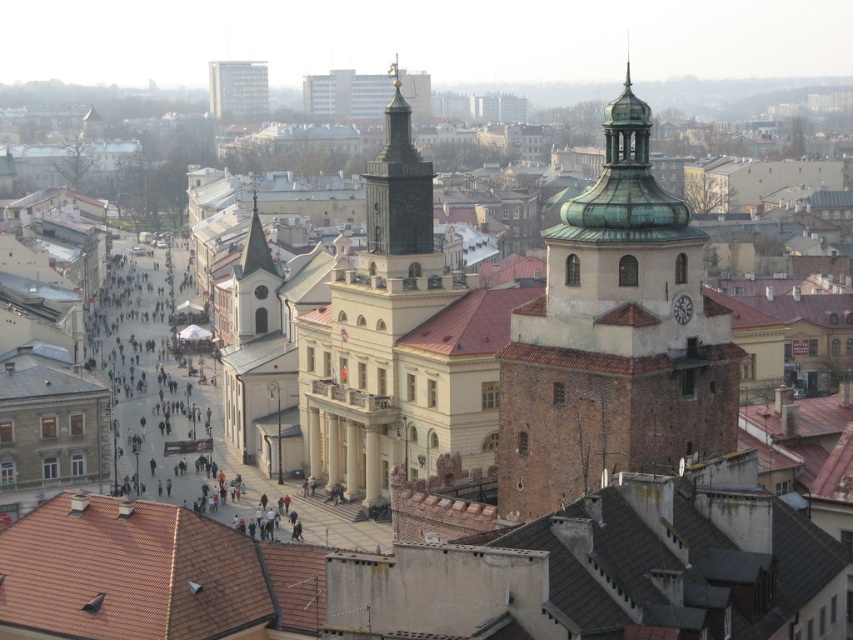
Does dark brown stone tower at center lie in front of smooth white spire at upper left?

Yes, dark brown stone tower at center is closer to the viewer.

Is dark brown stone tower at center bigger than smooth white spire at upper left?

Correct, dark brown stone tower at center is larger in size than smooth white spire at upper left.

Find the location of `dark brown stone tower at center`. dark brown stone tower at center is located at coordinates (379, 332).

Where is `dark brown stone tower at center`? The width and height of the screenshot is (853, 640). dark brown stone tower at center is located at coordinates (379, 332).

Does green copper dome at center right have a lesser width compared to matte gray building at upper center?

Indeed, green copper dome at center right has a lesser width compared to matte gray building at upper center.

Which of these two, green copper dome at center right or matte gray building at upper center, stands taller?

green copper dome at center right

Between point (602, 426) and point (242, 67), which one is positioned behind?

Point (242, 67)

Identify the location of green copper dome at center right. The image size is (853, 640). (614, 340).

Does green copper dome at center right have a greater height compared to dark brown stone tower at center?

In fact, green copper dome at center right may be shorter than dark brown stone tower at center.

Which is more to the right, green copper dome at center right or dark brown stone tower at center?

From the viewer's perspective, green copper dome at center right appears more on the right side.

Find the location of `green copper dome at center right`. green copper dome at center right is located at coordinates (614, 340).